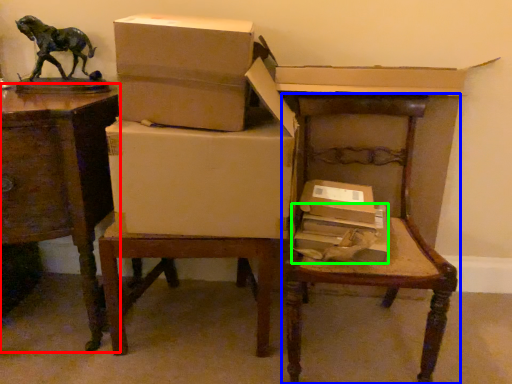
Question: Based on their relative distances, which object is farther from table (highlighted by a red box)? Choose from chair (highlighted by a blue box) and box (highlighted by a green box).

Choices:
 (A) chair
 (B) box

Answer: (A)